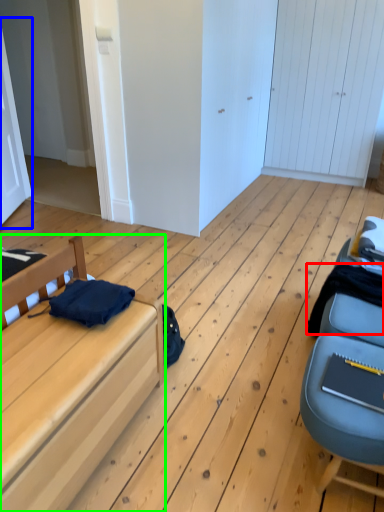
Question: Based on their relative distances, which object is farther from clothing (highlighted by a red box)? Choose from door (highlighted by a blue box) and furniture (highlighted by a green box).

Choices:
 (A) door
 (B) furniture

Answer: (A)